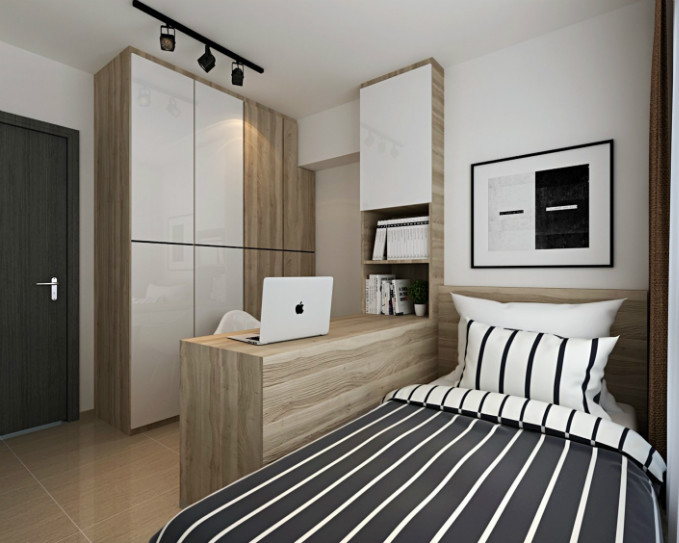
Find the location of a particular element. walls is located at coordinates (58, 92), (331, 138), (550, 92).